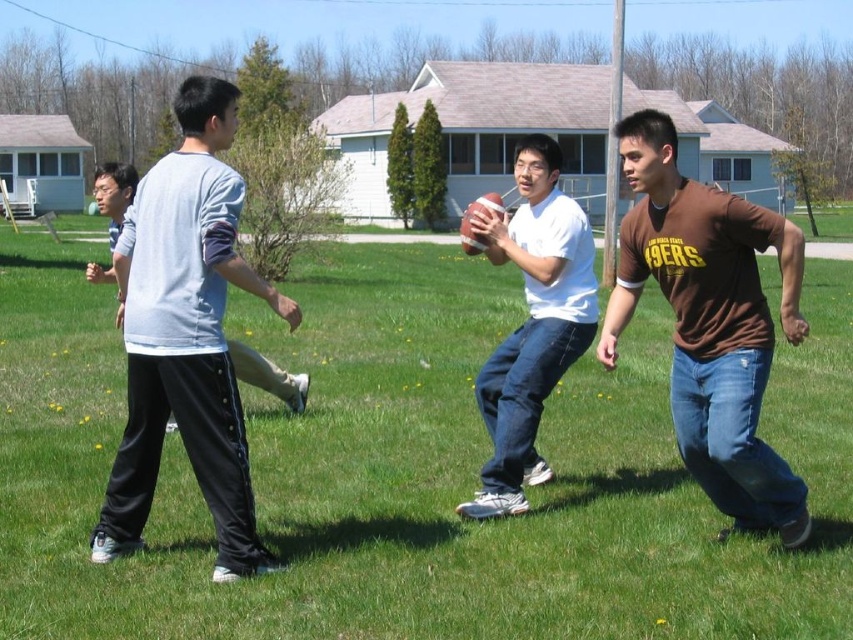
Is point (257, 337) positioned before point (701, 275)?

No, it is not.

Is green grass at center positioned in front of brown cotton t-shirt at right?

Yes, it is in front of brown cotton t-shirt at right.

At what (x,y) coordinates should I click in order to perform the action: click on green grass at center. Please return your answer as a coordinate pair (x, y). Looking at the image, I should click on (409, 470).

The width and height of the screenshot is (853, 640). I want to click on green grass at center, so click(409, 470).

Is green grass at center positioned at the back of light blue cotton shirt at left?

No, green grass at center is closer to the viewer.

Between green grass at center and light blue cotton shirt at left, which one is positioned lower?

light blue cotton shirt at left is below.

Is point (538, 580) positioned before point (181, 429)?

Yes, it is in front of point (181, 429).

What are the coordinates of `green grass at center` in the screenshot? It's located at (409, 470).

Which is below, green grass at center or white matte shirt at center?

green grass at center is lower down.

Does green grass at center have a lesser width compared to white matte shirt at center?

Incorrect, green grass at center's width is not less than white matte shirt at center's.

Locate an element on the screen. green grass at center is located at coordinates (409, 470).